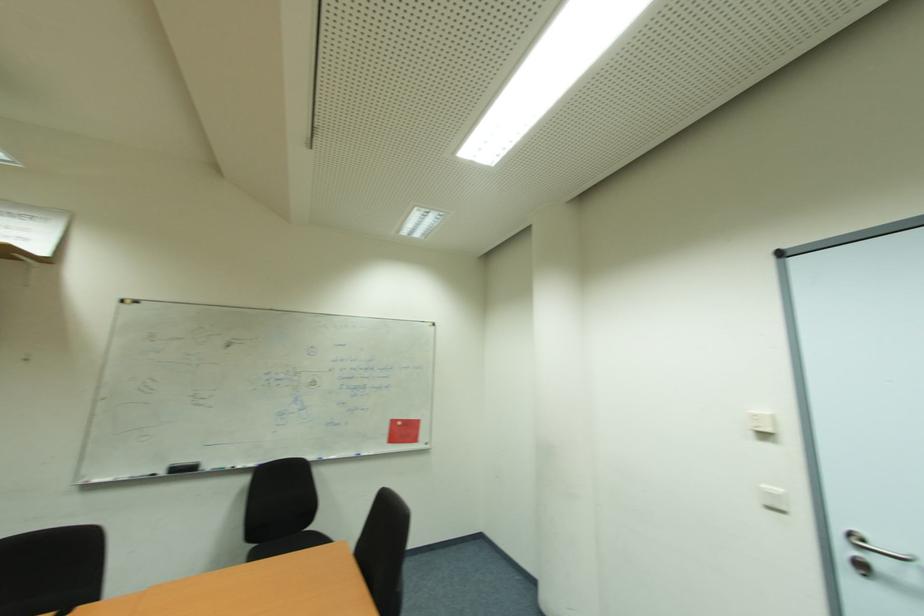
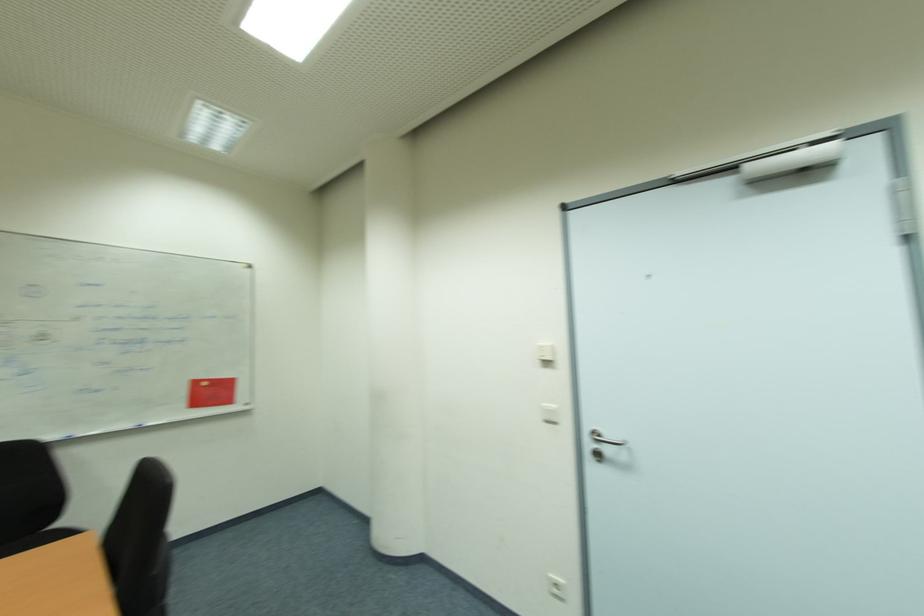
What movement of the cameraman would produce the second image?

The movement direction of the cameraman is right, forward.